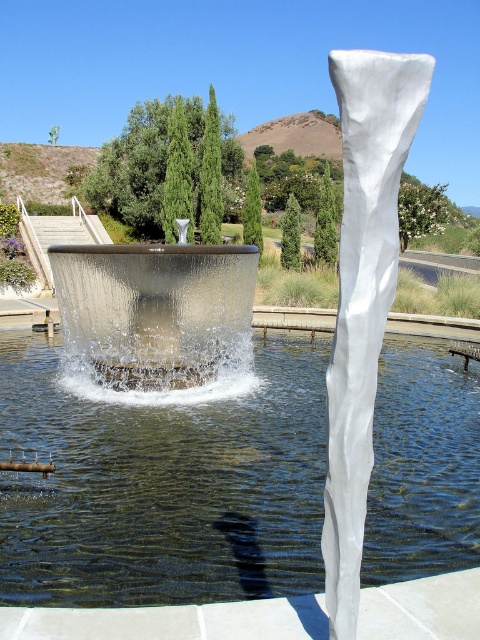
Question: Which point is closer to the camera?

Choices:
 (A) clear glass pool at center
 (B) translucent glass water at center

Answer: (A)

Question: Which of the following is the farthest from the observer?

Choices:
 (A) clear glass pool at center
 (B) translucent glass water at center

Answer: (B)

Question: Does clear glass pool at center have a lesser width compared to translucent glass water at center?

Choices:
 (A) yes
 (B) no

Answer: (A)

Question: Does clear glass pool at center appear over translucent glass water at center?

Choices:
 (A) yes
 (B) no

Answer: (B)

Question: Does clear glass pool at center appear over translucent glass water at center?

Choices:
 (A) yes
 (B) no

Answer: (B)

Question: Which object is farther from the camera taking this photo?

Choices:
 (A) clear glass pool at center
 (B) translucent glass water at center

Answer: (B)